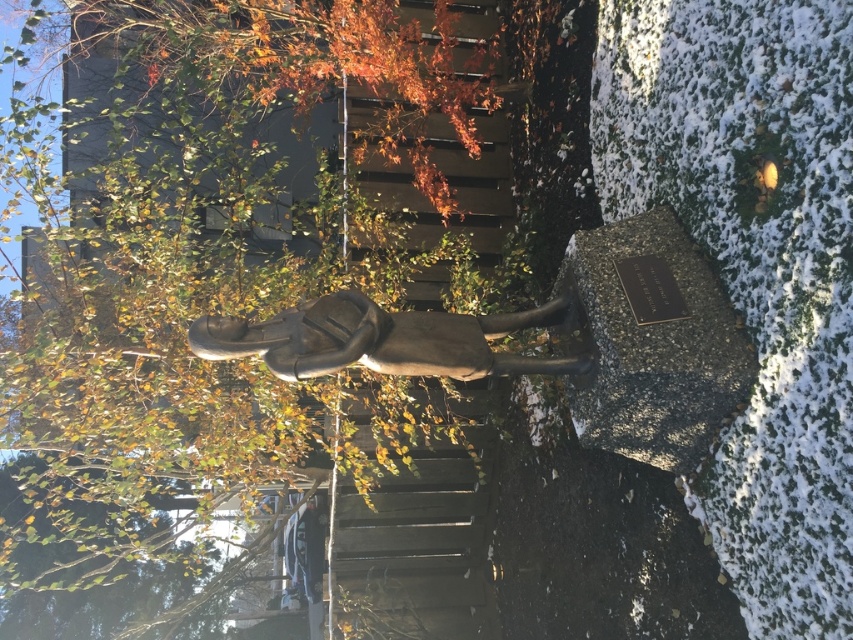
Can you confirm if green leafy tree at upper left is positioned above metallic stairwell at center?

Correct, green leafy tree at upper left is located above metallic stairwell at center.

Is green leafy tree at upper left shorter than metallic stairwell at center?

No.

The image size is (853, 640). In order to click on green leafy tree at upper left in this screenshot , I will do [x=184, y=321].

This screenshot has width=853, height=640. Find the location of `green leafy tree at upper left`. green leafy tree at upper left is located at coordinates (184, 321).

Can you confirm if green leafy tree at upper left is positioned to the right of bronze statue at center?

In fact, green leafy tree at upper left is to the left of bronze statue at center.

Which is behind, point (399, 492) or point (386, 369)?

Positioned behind is point (399, 492).

Measure the distance between green leafy tree at upper left and camera.

green leafy tree at upper left is 4.21 meters away from camera.

Where is `green leafy tree at upper left`? This screenshot has height=640, width=853. green leafy tree at upper left is located at coordinates (184, 321).

Is metallic stairwell at center positioned at the back of bronze statue at center?

That is True.

Looking at this image, is metallic stairwell at center to the left of bronze statue at center from the viewer's perspective?

Incorrect, metallic stairwell at center is not on the left side of bronze statue at center.

Between point (431, 595) and point (480, 371), which one is positioned in front?

Point (480, 371) is more forward.

The height and width of the screenshot is (640, 853). I want to click on metallic stairwell at center, so click(415, 548).